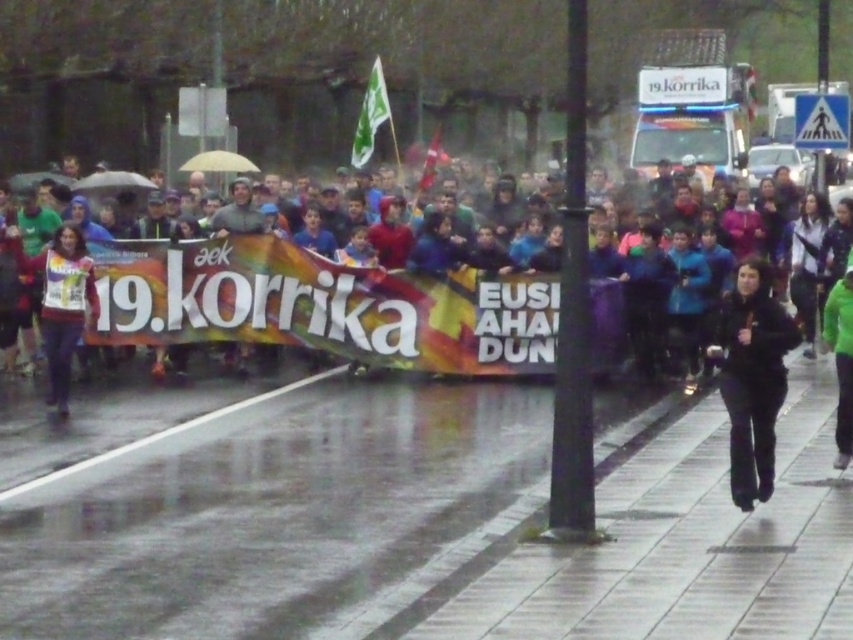
Can you confirm if black matte pants at lower right is thinner than matte white shirt at left?

No.

Can you confirm if black matte pants at lower right is positioned below matte white shirt at left?

Indeed, black matte pants at lower right is positioned under matte white shirt at left.

The width and height of the screenshot is (853, 640). Find the location of `black matte pants at lower right`. black matte pants at lower right is located at coordinates (752, 378).

In order to click on black matte pants at lower right in this screenshot , I will do `click(752, 378)`.

Who is lower down, black matte pants at lower right or green matte jacket at lower right?

Positioned lower is black matte pants at lower right.

Which is more to the left, black matte pants at lower right or green matte jacket at lower right?

Result: black matte pants at lower right is more to the left.

Image resolution: width=853 pixels, height=640 pixels. What are the coordinates of `black matte pants at lower right` in the screenshot? It's located at (752, 378).

Is matte white shirt at left smaller than green matte jacket at lower right?

Incorrect, matte white shirt at left is not smaller in size than green matte jacket at lower right.

This screenshot has height=640, width=853. What do you see at coordinates (61, 301) in the screenshot?
I see `matte white shirt at left` at bounding box center [61, 301].

Who is more distant from viewer, (68, 294) or (834, 444)?

Point (68, 294)

Find the location of a particular element. matte white shirt at left is located at coordinates (61, 301).